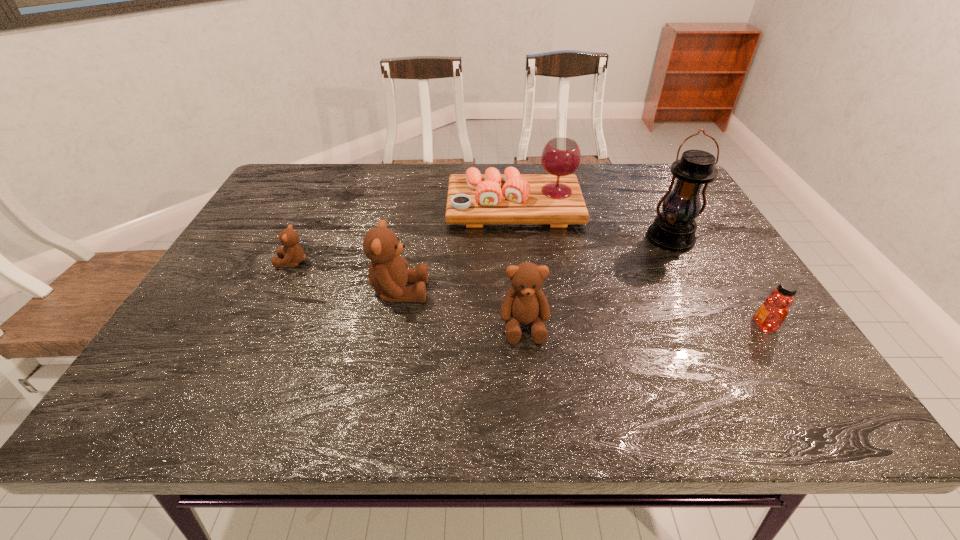
Please point a spot on the right to add another teddy bear. Please provide its 2D coordinates. Your answer should be formatted as a tuple, i.e. [(x, y)], where the tuple contains the x and y coordinates of a point satisfying the conditions above.

[(670, 364)]